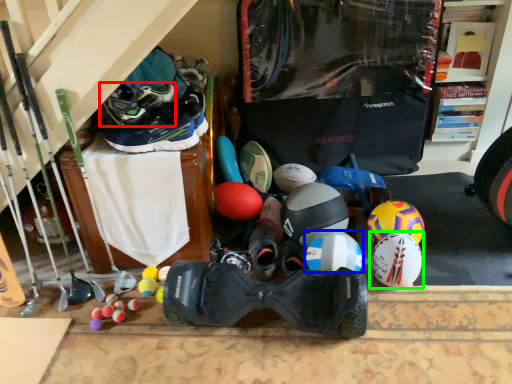
Question: Considering the real-world distances, which object is closest to footwear (highlighted by a red box)? helmet (highlighted by a blue box) or helmet (highlighted by a green box).

Choices:
 (A) helmet
 (B) helmet

Answer: (A)